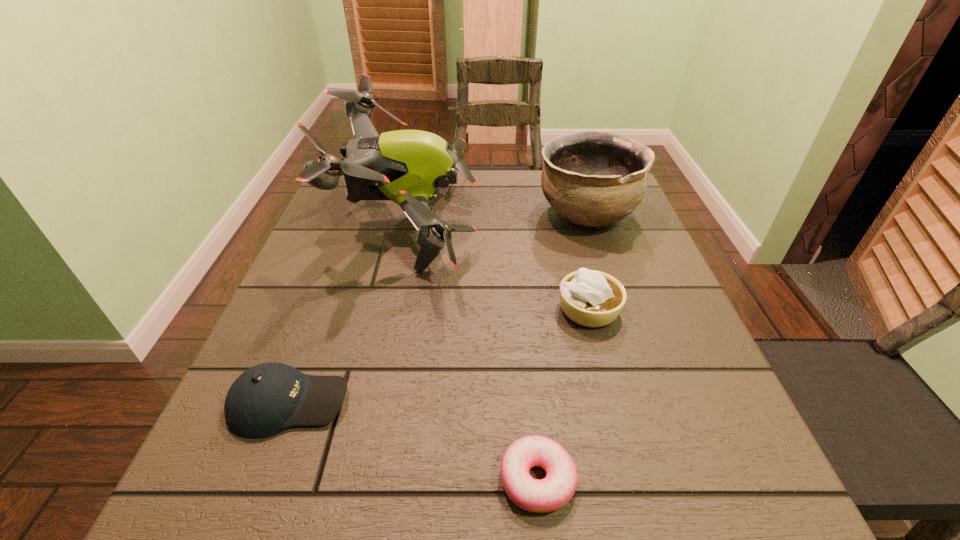
Where is `vacant area in the image that satisfies the following two spatial constraints: 1. on the front-facing side of the fourth tallest object; 2. on the left side of the doughnut`? vacant area in the image that satisfies the following two spatial constraints: 1. on the front-facing side of the fourth tallest object; 2. on the left side of the doughnut is located at coordinates (261, 479).

This screenshot has width=960, height=540. I want to click on vacant space that satisfies the following two spatial constraints: 1. on the front-facing side of the tallest object; 2. on the back side of the third shortest object, so click(391, 309).

Locate an element on the screen. This screenshot has width=960, height=540. free space that satisfies the following two spatial constraints: 1. on the front-facing side of the tallest object; 2. on the left side of the third shortest object is located at coordinates (391, 309).

The image size is (960, 540). I want to click on vacant area in the image that satisfies the following two spatial constraints: 1. on the front-facing side of the tallest object; 2. on the right side of the third tallest object, so click(x=391, y=309).

Where is `vacant area that satisfies the following two spatial constraints: 1. on the front-facing side of the nearest object; 2. on the right side of the fourth tallest object`? vacant area that satisfies the following two spatial constraints: 1. on the front-facing side of the nearest object; 2. on the right side of the fourth tallest object is located at coordinates (261, 479).

Where is `vacant space that satisfies the following two spatial constraints: 1. on the front-facing side of the whipped cream; 2. on the left side of the drone`? The width and height of the screenshot is (960, 540). vacant space that satisfies the following two spatial constraints: 1. on the front-facing side of the whipped cream; 2. on the left side of the drone is located at coordinates (391, 309).

The width and height of the screenshot is (960, 540). I want to click on free space that satisfies the following two spatial constraints: 1. on the front-facing side of the shortest object; 2. on the right side of the fourth farthest object, so click(261, 479).

Image resolution: width=960 pixels, height=540 pixels. Find the location of `free location that satisfies the following two spatial constraints: 1. on the front-facing side of the third object from left to right; 2. on the left side of the drone`. free location that satisfies the following two spatial constraints: 1. on the front-facing side of the third object from left to right; 2. on the left side of the drone is located at coordinates (355, 479).

You are a GUI agent. You are given a task and a screenshot of the screen. Output one action in this format:
    pyautogui.click(x=<x>, y=<y>)
    Task: Click on the vacant position in the image that satisfies the following two spatial constraints: 1. on the front-facing side of the drone; 2. on the right side of the third shortest object
    
    Given the screenshot: What is the action you would take?
    pyautogui.click(x=391, y=309)